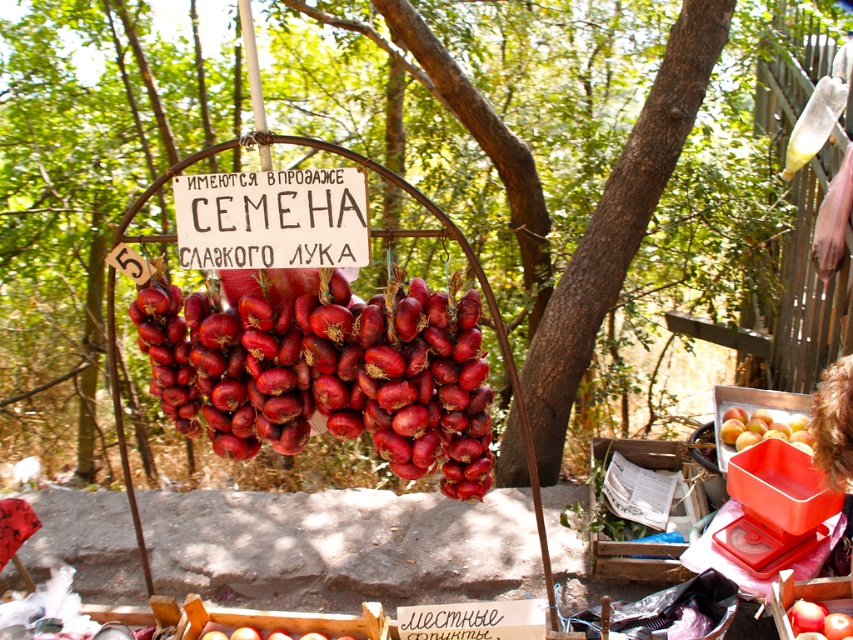
You are a farmer who wants to plant onions. You see the shiny red onion at center and the smooth red peaches at right. Which object is taller?

The shiny red onion at center is taller than the smooth red peaches at right.

You are a customer at the market and want to pick up both the shiny red onion at center and the smooth red peaches at right. Which item should you reach for first to avoid obstructing your view of the other?

You should reach for the shiny red onion at center first because it is closer to the viewer than the smooth red peaches at right. Picking up the closer item first will prevent blocking the view of the one further away.